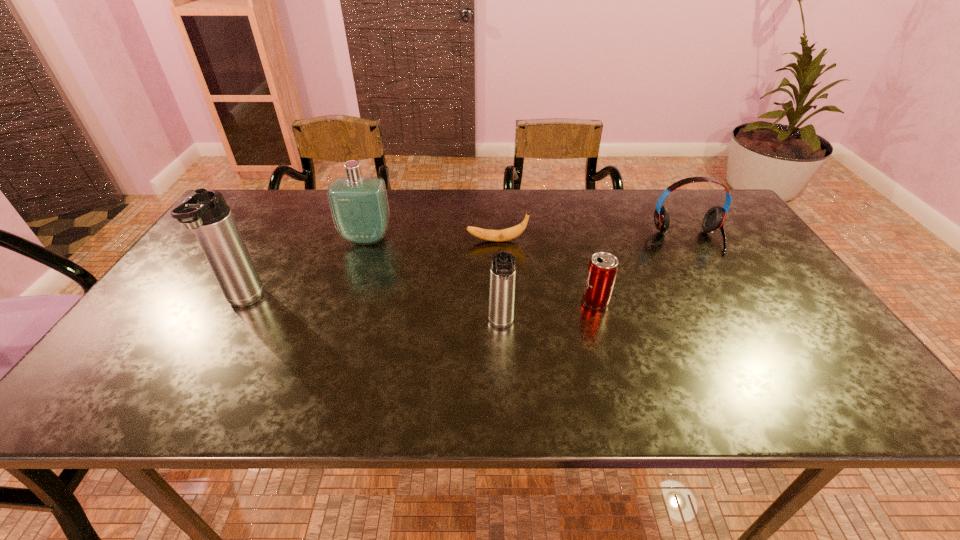
Where is `vacant area situated 0.320m with the microphone attached to the side of the headset`? vacant area situated 0.320m with the microphone attached to the side of the headset is located at coordinates (751, 344).

Find the location of `free space located on the peel of the shortest object from the top`. free space located on the peel of the shortest object from the top is located at coordinates (343, 241).

This screenshot has width=960, height=540. What are the coordinates of `vacant space located 0.100m on the peel of the shortest object from the top` in the screenshot? It's located at (432, 241).

Where is `vacant region located on the peel of the shortest object from the top`? vacant region located on the peel of the shortest object from the top is located at coordinates (352, 241).

This screenshot has width=960, height=540. Identify the location of free space located 0.160m on the left of the fifth object from left to right. (517, 301).

I want to click on vacant area located on the front label of the perfume, so click(x=336, y=330).

Find the location of `headset situated at the far edge`. headset situated at the far edge is located at coordinates (714, 219).

I want to click on perfume that is at the far edge, so click(x=359, y=206).

In order to click on object at the right edge in this screenshot , I will do `click(714, 219)`.

Where is `object at the far right corner`? The height and width of the screenshot is (540, 960). object at the far right corner is located at coordinates (714, 219).